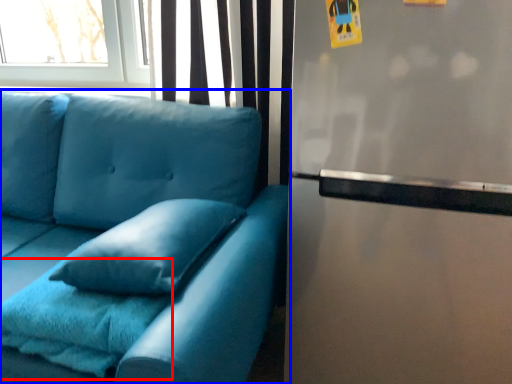
Question: Which point is closer to the camera, blanket (highlighted by a red box) or studio couch (highlighted by a blue box)?

Choices:
 (A) blanket
 (B) studio couch

Answer: (B)